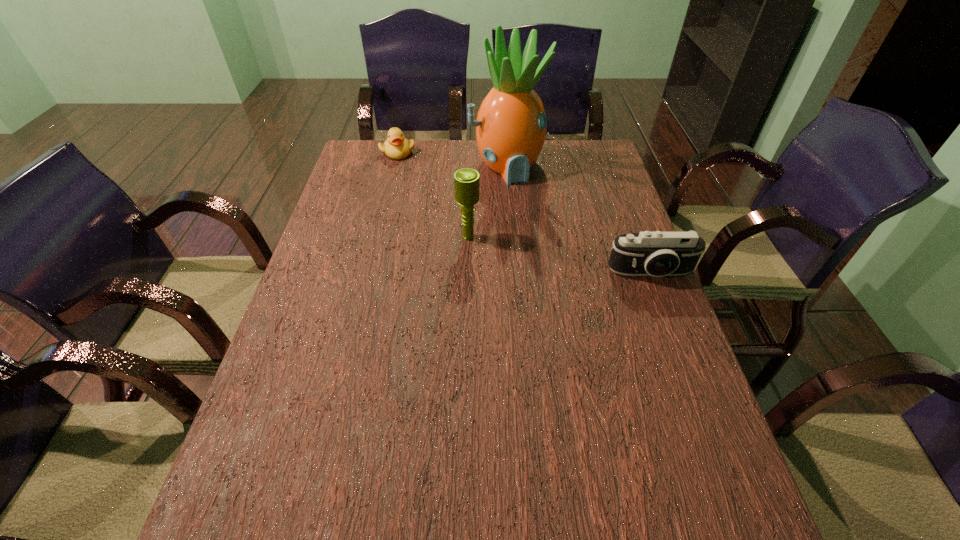
Find the location of a particular element. The width and height of the screenshot is (960, 540). vacant region located at the entrance of the tallest object is located at coordinates (558, 246).

The image size is (960, 540). What are the coordinates of `free space located at the entrance of the tallest object` in the screenshot? It's located at [540, 218].

This screenshot has width=960, height=540. I want to click on free point located on the front-facing side of the duckling, so click(472, 204).

The width and height of the screenshot is (960, 540). What are the coordinates of `vacant region located 0.340m on the front-facing side of the duckling` in the screenshot? It's located at (470, 202).

I want to click on free space located 0.120m on the front-facing side of the duckling, so click(428, 173).

The height and width of the screenshot is (540, 960). Find the location of `pineapple situated at the far edge`. pineapple situated at the far edge is located at coordinates (511, 125).

At what (x,y) coordinates should I click in order to perform the action: click on duckling present at the far edge. Please return your answer as a coordinate pair (x, y). Looking at the image, I should click on (397, 147).

Locate an element on the screen. object at the left edge is located at coordinates (397, 147).

Find the location of a particular element. This screenshot has width=960, height=540. object that is at the right edge is located at coordinates (657, 254).

The image size is (960, 540). I want to click on object at the far left corner, so click(397, 147).